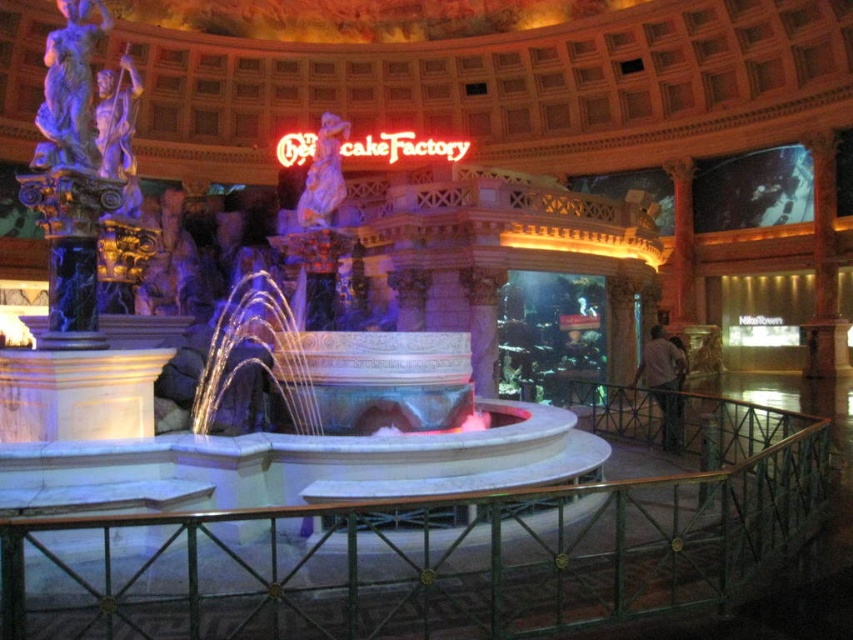
Is green metal railing at center further to camera compared to neontexturedsign at center?

No.

Does green metal railing at center have a greater width compared to neontexturedsign at center?

Indeed, green metal railing at center has a greater width compared to neontexturedsign at center.

Who is more distant from viewer, (492, 621) or (457, 154)?

Positioned behind is point (457, 154).

Find the location of a particular element. green metal railing at center is located at coordinates (432, 554).